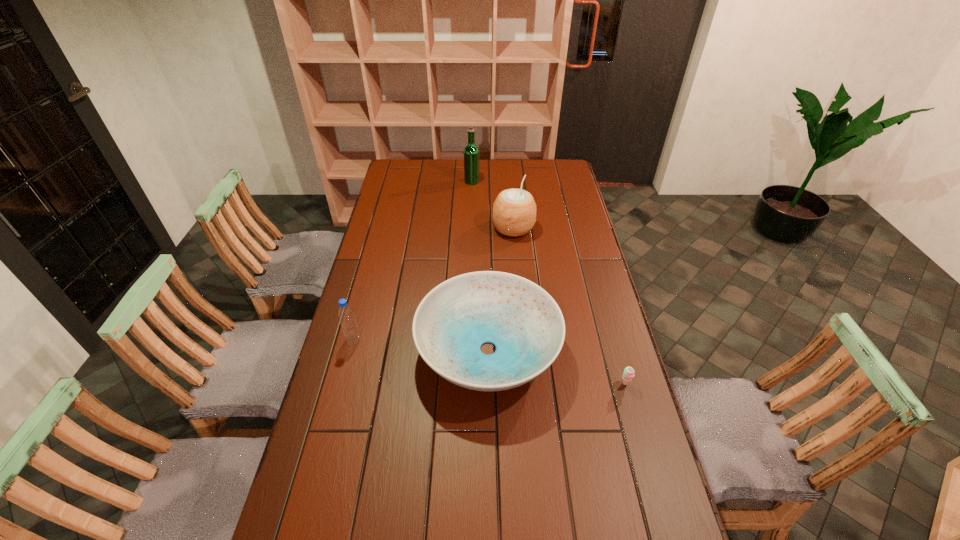
Locate an element on the screen. free spot located 0.130m on the left of the second farthest object is located at coordinates (462, 228).

What are the coordinates of `free space located on the back of the third tallest object` in the screenshot? It's located at 372,268.

Image resolution: width=960 pixels, height=540 pixels. What are the coordinates of `free region located on the left of the second shortest object` in the screenshot? It's located at (373, 349).

The image size is (960, 540). Find the location of `free space located on the front of the rightmost object`. free space located on the front of the rightmost object is located at coordinates (651, 476).

I want to click on object present at the far edge, so click(471, 152).

In order to click on object located in the left edge section of the desktop in this screenshot , I will do `click(346, 315)`.

Image resolution: width=960 pixels, height=540 pixels. Find the location of `object that is positioned at the right edge`. object that is positioned at the right edge is located at coordinates (628, 374).

Locate an element on the screen. The height and width of the screenshot is (540, 960). free space at the far edge of the desktop is located at coordinates (517, 166).

Identify the location of vacant space at the left edge of the desktop. This screenshot has height=540, width=960. (392, 193).

Find the location of a particular element. This screenshot has width=960, height=540. vacant space at the right edge of the desktop is located at coordinates (568, 200).